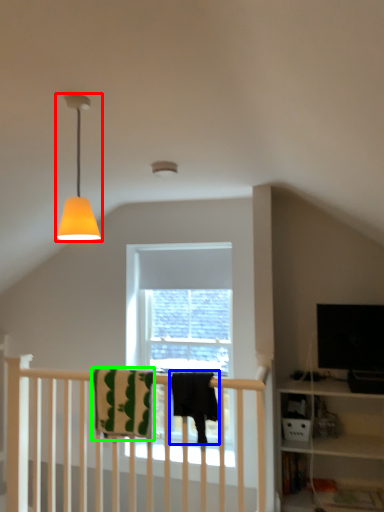
Question: Considering the real-world distances, which object is farthest from lamp (highlighted by a red box)? beach towel (highlighted by a blue box) or beach towel (highlighted by a green box)?

Choices:
 (A) beach towel
 (B) beach towel

Answer: (B)